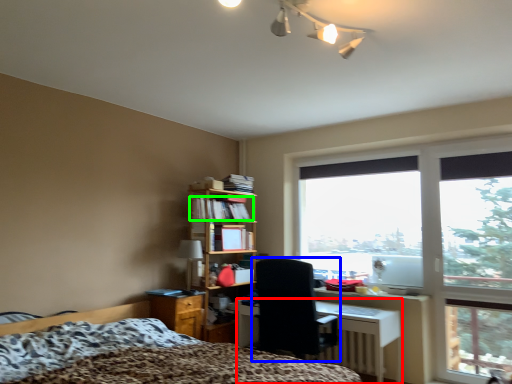
Question: Which object is the closest to the desk (highlighted by a red box)? Choose among these: chair (highlighted by a blue box) or book (highlighted by a green box).

Choices:
 (A) chair
 (B) book

Answer: (A)